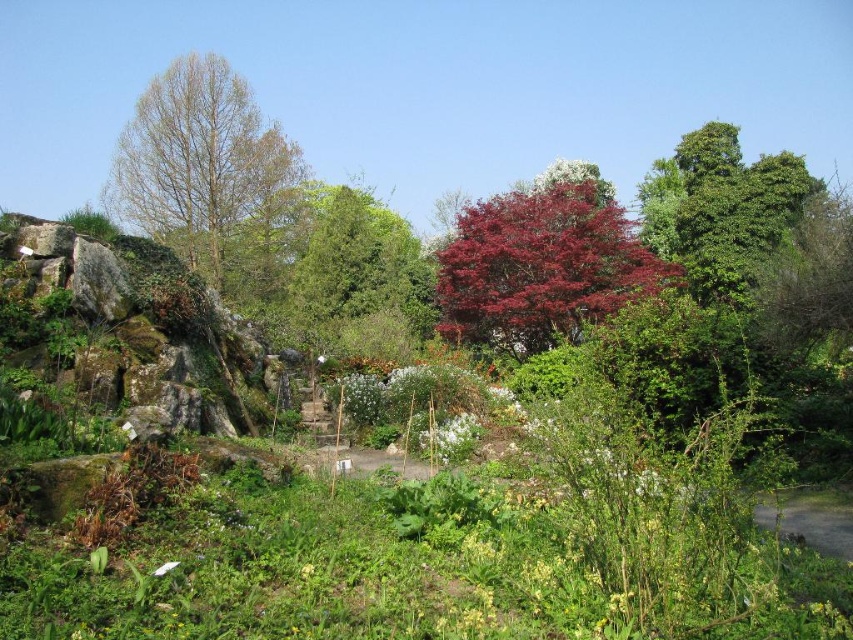
Question: Based on their relative distances, which object is nearer to the bare wood tree at left?

Choices:
 (A) glossy red tree at center
 (B) green mossy rock at left

Answer: (A)

Question: Does green mossy rock at left come in front of bare wood tree at left?

Choices:
 (A) no
 (B) yes

Answer: (B)

Question: Is the position of green mossy rock at left more distant than that of bare wood tree at left?

Choices:
 (A) yes
 (B) no

Answer: (B)

Question: Among these objects, which one is nearest to the camera?

Choices:
 (A) green mossy rock at left
 (B) glossy red tree at center

Answer: (A)

Question: Which of the following is the closest to the observer?

Choices:
 (A) (486, 244)
 (B) (279, 218)
 (C) (123, 259)

Answer: (C)

Question: Is bare wood tree at left behind glossy red tree at center?

Choices:
 (A) no
 (B) yes

Answer: (B)